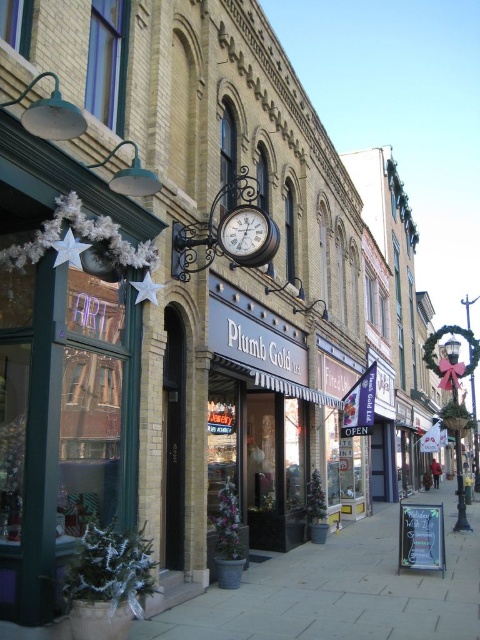
Between smooth concrete sidewalk at center and matte black clock at center, which one is positioned lower?

smooth concrete sidewalk at center is lower down.

Is smooth concrete sidewalk at center wider than matte black clock at center?

Yes, smooth concrete sidewalk at center is wider than matte black clock at center.

Is point (452, 497) behind point (252, 262)?

Yes, point (452, 497) is farther from viewer.

Locate an element on the screen. smooth concrete sidewalk at center is located at coordinates point(342,589).